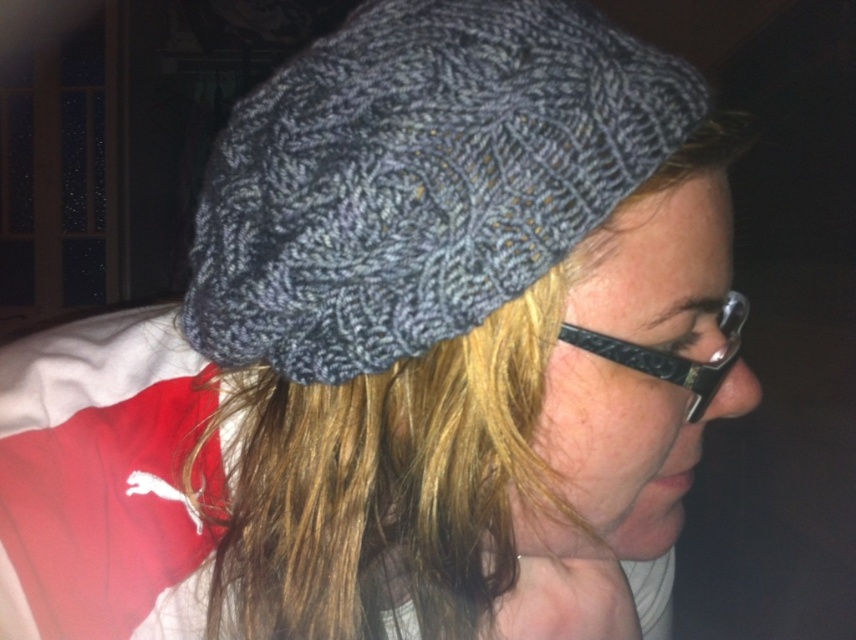
Question: Can you confirm if knitted gray hat at upper center is smaller than black textured glasses at center?

Choices:
 (A) yes
 (B) no

Answer: (B)

Question: Among these points, which one is farthest from the camera?

Choices:
 (A) (562, 324)
 (B) (498, 202)

Answer: (A)

Question: Is knitted gray hat at upper center above black textured glasses at center?

Choices:
 (A) yes
 (B) no

Answer: (A)

Question: Observing the image, what is the correct spatial positioning of knitted gray hat at upper center in reference to black textured glasses at center?

Choices:
 (A) above
 (B) below

Answer: (A)

Question: Which point is closer to the camera taking this photo?

Choices:
 (A) (324, 336)
 (B) (694, 419)

Answer: (A)